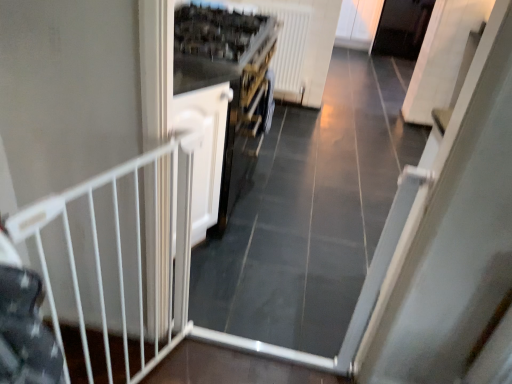
Question: Should I look upward or downward to see white metal gate at left?

Choices:
 (A) down
 (B) up

Answer: (A)

Question: Should I look upward or downward to see white matte door at center?

Choices:
 (A) up
 (B) down

Answer: (A)

Question: Is white metal gate at left not close to white plastic radiator at upper center?

Choices:
 (A) yes
 (B) no

Answer: (A)

Question: Considering the relative sizes of white metal gate at left and white plastic radiator at upper center in the image provided, is white metal gate at left taller than white plastic radiator at upper center?

Choices:
 (A) yes
 (B) no

Answer: (A)

Question: Can you confirm if white metal gate at left is thinner than white plastic radiator at upper center?

Choices:
 (A) yes
 (B) no

Answer: (A)

Question: Considering the relative positions of white metal gate at left and white plastic radiator at upper center in the image provided, is white metal gate at left to the left of white plastic radiator at upper center from the viewer's perspective?

Choices:
 (A) yes
 (B) no

Answer: (A)

Question: Is white metal gate at left oriented away from white plastic radiator at upper center?

Choices:
 (A) no
 (B) yes

Answer: (A)

Question: Is white metal gate at left to the right of white plastic radiator at upper center from the viewer's perspective?

Choices:
 (A) no
 (B) yes

Answer: (A)

Question: Are white matte door at center and white metal gate at left located far from each other?

Choices:
 (A) no
 (B) yes

Answer: (A)

Question: Considering the relative sizes of white matte door at center and white metal gate at left in the image provided, is white matte door at center bigger than white metal gate at left?

Choices:
 (A) yes
 (B) no

Answer: (A)

Question: Is white matte door at center in front of white metal gate at left?

Choices:
 (A) no
 (B) yes

Answer: (A)

Question: Considering the relative sizes of white matte door at center and white metal gate at left in the image provided, is white matte door at center taller than white metal gate at left?

Choices:
 (A) no
 (B) yes

Answer: (A)

Question: Is white matte door at center further to camera compared to white metal gate at left?

Choices:
 (A) no
 (B) yes

Answer: (B)

Question: Is white matte door at center shorter than white metal gate at left?

Choices:
 (A) yes
 (B) no

Answer: (A)

Question: Does white plastic radiator at upper center have a lesser width compared to white metal gate at left?

Choices:
 (A) no
 (B) yes

Answer: (A)